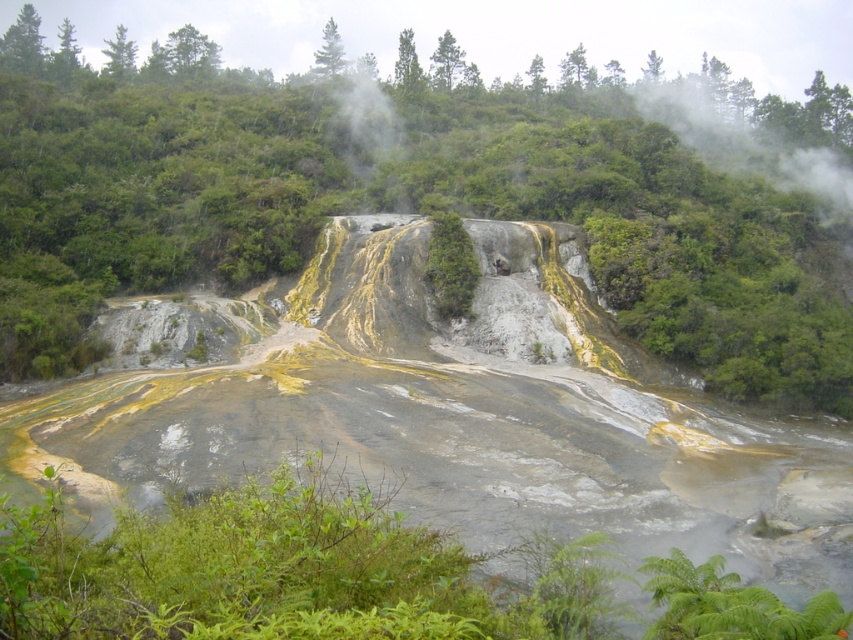
You are standing at the point marked by coordinates point (453, 410) in the image. What type of rock are you currently standing on?

You are standing on yellowish sedimentary rock at center.

You are standing at the origin point of the scene. Which direction should you move to reach the green leafy shrubs at lower center?

The green leafy shrubs at lower center are located at point 0.897 on the x axis and 0.334 on the y axis, so you should move towards the lower center direction to reach them.

You are standing at the point closer to the camera in this geothermal landscape. Which point are you at, point (x=793, y=307) or point (x=518, y=602)?

You are at point (x=793, y=307) because it is further to the camera than point (x=518, y=602).